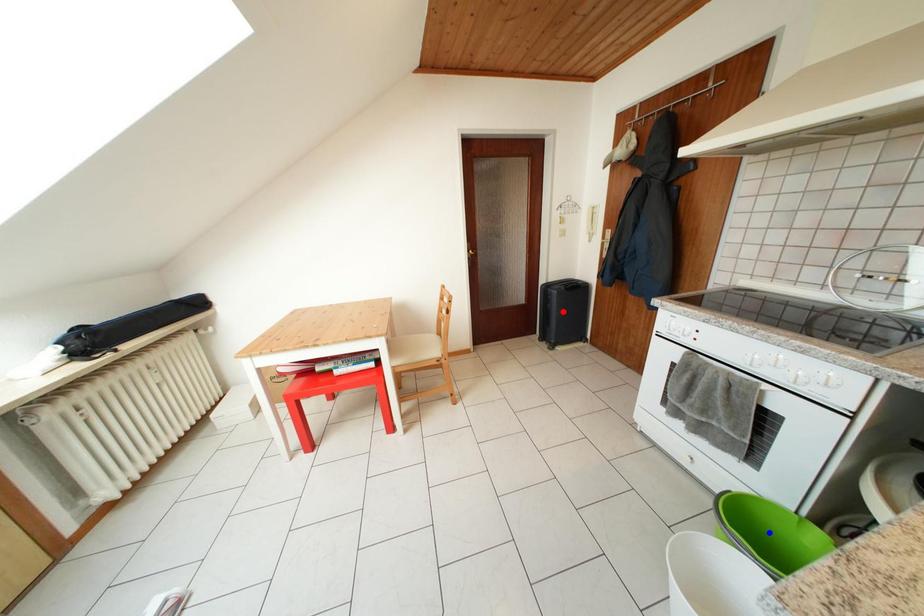
Question: Two points are marked on the image. Which point is closer to the camera?

Choices:
 (A) Blue point is closer.
 (B) Red point is closer.

Answer: (A)